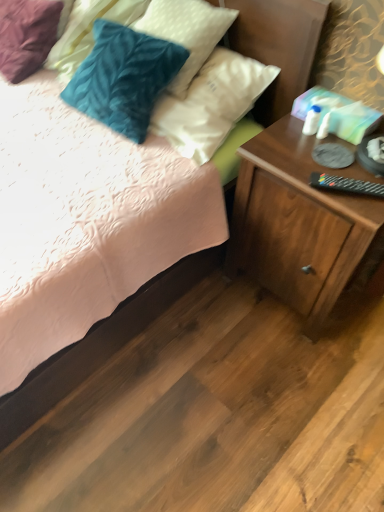
What do you see at coordinates (346, 185) in the screenshot? I see `black plastic remote control at right` at bounding box center [346, 185].

What do you see at coordinates (186, 32) in the screenshot? This screenshot has height=512, width=384. I see `velvety blue pillow at upper left, which is the first pillow in right-to-left order` at bounding box center [186, 32].

This screenshot has height=512, width=384. Find the location of `wooden nightstand at lower right`. wooden nightstand at lower right is located at coordinates (299, 223).

From the image's perspective, is wooden nightstand at lower right below velvety teal pillow at upper left, the first pillow in the left-to-right sequence?

Indeed, from the image's perspective, wooden nightstand at lower right is shown beneath velvety teal pillow at upper left, the first pillow in the left-to-right sequence.

Does wooden nightstand at lower right appear on the left side of velvety teal pillow at upper left, the first pillow in the left-to-right sequence?

No.

Between wooden nightstand at lower right and velvety teal pillow at upper left, the 2th pillow viewed from the right, which one has larger size?

With larger size is wooden nightstand at lower right.

Which of these two, wooden nightstand at lower right or velvety teal pillow at upper left, the first pillow in the left-to-right sequence, stands shorter?

velvety teal pillow at upper left, the first pillow in the left-to-right sequence, is shorter.

From the picture: From a real-world perspective, is velvety teal pillow at upper left, the 2th pillow viewed from the right, physically above velvety blue pillow at upper left, the 2th pillow from the left?

Actually, velvety teal pillow at upper left, the 2th pillow viewed from the right, is physically below velvety blue pillow at upper left, the 2th pillow from the left, in the real world.

In the scene shown: Considering the relative sizes of velvety teal pillow at upper left, the 2th pillow viewed from the right, and velvety blue pillow at upper left, which is the first pillow in right-to-left order, in the image provided, is velvety teal pillow at upper left, the 2th pillow viewed from the right, bigger than velvety blue pillow at upper left, which is the first pillow in right-to-left order,?

Yes.

Find the location of `pillow behind the velvety blue pillow at upper left, which is the first pillow in right-to-left order`. pillow behind the velvety blue pillow at upper left, which is the first pillow in right-to-left order is located at coordinates (88, 31).

Could you measure the distance between velvety teal pillow at upper left, the first pillow in the left-to-right sequence, and velvety blue pillow at upper left, which is the first pillow in right-to-left order?

A distance of 11.94 inches exists between velvety teal pillow at upper left, the first pillow in the left-to-right sequence, and velvety blue pillow at upper left, which is the first pillow in right-to-left order.

From a real-world perspective, between velvety teal pillow at upper left, the 2th pillow viewed from the right, and black plastic remote control at right, who is vertically higher?

black plastic remote control at right, from a real-world perspective.

Between point (80, 13) and point (311, 176), which one is positioned behind?

Positioned behind is point (80, 13).

Is velvety teal pillow at upper left, the first pillow in the left-to-right sequence, taller than black plastic remote control at right?

Correct, velvety teal pillow at upper left, the first pillow in the left-to-right sequence, is much taller as black plastic remote control at right.

From the image's perspective, which one is positioned lower, velvety teal pillow at upper left, the first pillow in the left-to-right sequence, or black plastic remote control at right?

black plastic remote control at right.

There is a black plastic remote control at right. In order to click on the 1st pillow above it (from the image's perspective) in this screenshot , I will do (x=186, y=32).

Considering the positions of objects velvety blue pillow at upper left, the 2th pillow from the left, and black plastic remote control at right in the image provided, who is in front, velvety blue pillow at upper left, the 2th pillow from the left, or black plastic remote control at right?

black plastic remote control at right is closer to the camera.

Considering the sizes of velvety blue pillow at upper left, the 2th pillow from the left, and black plastic remote control at right in the image, is velvety blue pillow at upper left, the 2th pillow from the left, bigger or smaller than black plastic remote control at right?

In the image, velvety blue pillow at upper left, the 2th pillow from the left, appears to be larger than black plastic remote control at right.

Which is less distant, (x=177, y=1) or (x=357, y=182)?

Point (x=177, y=1) is positioned farther from the camera compared to point (x=357, y=182).

Does black plastic remote control at right have a lesser height compared to velvety teal pillow at upper left, the 2th pillow viewed from the right?

Indeed, black plastic remote control at right has a lesser height compared to velvety teal pillow at upper left, the 2th pillow viewed from the right.

Who is smaller, black plastic remote control at right or velvety teal pillow at upper left, the 2th pillow viewed from the right?

With smaller size is black plastic remote control at right.

Is black plastic remote control at right in contact with velvety teal pillow at upper left, the 2th pillow viewed from the right?

No, black plastic remote control at right is not beside velvety teal pillow at upper left, the 2th pillow viewed from the right.

Is black plastic remote control at right looking in the opposite direction of velvety teal pillow at upper left, the first pillow in the left-to-right sequence?

No, black plastic remote control at right's orientation is not away from velvety teal pillow at upper left, the first pillow in the left-to-right sequence.

Can you confirm if velvety teal pillow at upper left, the 2th pillow viewed from the right, is smaller than wooden nightstand at lower right?

Correct, velvety teal pillow at upper left, the 2th pillow viewed from the right, occupies less space than wooden nightstand at lower right.

Could you tell me if velvety teal pillow at upper left, the 2th pillow viewed from the right, is facing wooden nightstand at lower right?

No, velvety teal pillow at upper left, the 2th pillow viewed from the right, is not oriented towards wooden nightstand at lower right.

Consider the image. Is velvety teal pillow at upper left, the 2th pillow viewed from the right, behind wooden nightstand at lower right?

Yes, it is.

From the image's perspective, which is above, velvety teal pillow at upper left, the 2th pillow viewed from the right, or wooden nightstand at lower right?

velvety teal pillow at upper left, the 2th pillow viewed from the right.

Is point (342, 183) positioned in front of point (176, 7)?

That is True.

Is black plastic remote control at right smaller than velvety blue pillow at upper left, the 2th pillow from the left?

Indeed, black plastic remote control at right has a smaller size compared to velvety blue pillow at upper left, the 2th pillow from the left.

Which is more to the right, black plastic remote control at right or velvety blue pillow at upper left, the 2th pillow from the left?

From the viewer's perspective, black plastic remote control at right appears more on the right side.

Based on the photo, is black plastic remote control at right turned away from velvety blue pillow at upper left, which is the first pillow in right-to-left order?

black plastic remote control at right is not turned away from velvety blue pillow at upper left, which is the first pillow in right-to-left order.

At what (x,y) coordinates should I click in order to perform the action: click on the 2nd pillow above when counting from the wooden nightstand at lower right (from the image's perspective). Please return your answer as a coordinate pair (x, y). The height and width of the screenshot is (512, 384). Looking at the image, I should click on (88, 31).

Identify the location of pillow below the velvety blue pillow at upper left, which is the first pillow in right-to-left order (from a real-world perspective). (88, 31).

When comparing their distances from velvety teal pillow at upper left, the first pillow in the left-to-right sequence, does velvety blue pillow at upper left, which is the first pillow in right-to-left order, or black plastic remote control at right seem closer?

Based on the image, velvety blue pillow at upper left, which is the first pillow in right-to-left order, appears to be nearer to velvety teal pillow at upper left, the first pillow in the left-to-right sequence.

From the image, which object appears to be farther from black plastic remote control at right, velvety blue pillow at upper left, which is the first pillow in right-to-left order, or wooden nightstand at lower right?

Among the two, velvety blue pillow at upper left, which is the first pillow in right-to-left order, is located further to black plastic remote control at right.

Which object lies further to the anchor point black plastic remote control at right, wooden nightstand at lower right or velvety blue pillow at upper left, which is the first pillow in right-to-left order?

velvety blue pillow at upper left, which is the first pillow in right-to-left order, is positioned further to the anchor black plastic remote control at right.

Based on their spatial positions, is black plastic remote control at right or velvety teal pillow at upper left, the 2th pillow viewed from the right, further from wooden nightstand at lower right?

The object further to wooden nightstand at lower right is velvety teal pillow at upper left, the 2th pillow viewed from the right.

Estimate the real-world distances between objects in this image. Which object is further from black plastic remote control at right, velvety teal pillow at upper left, the 2th pillow viewed from the right, or velvety blue pillow at upper left, which is the first pillow in right-to-left order?

velvety teal pillow at upper left, the 2th pillow viewed from the right, lies further to black plastic remote control at right than the other object.

Looking at the image, which one is located closer to wooden nightstand at lower right, black plastic remote control at right or velvety blue pillow at upper left, the 2th pillow from the left?

Among the two, black plastic remote control at right is located nearer to wooden nightstand at lower right.

Considering their positions, is black plastic remote control at right positioned further to velvety teal pillow at upper left, the 2th pillow viewed from the right, than velvety blue pillow at upper left, which is the first pillow in right-to-left order?

Based on the image, black plastic remote control at right appears to be further to velvety teal pillow at upper left, the 2th pillow viewed from the right.

Which object lies further to the anchor point wooden nightstand at lower right, velvety blue pillow at upper left, which is the first pillow in right-to-left order, or velvety teal pillow at upper left, the 2th pillow viewed from the right?

velvety teal pillow at upper left, the 2th pillow viewed from the right, lies further to wooden nightstand at lower right than the other object.

Locate an element on the screen. pillow between velvety teal pillow at upper left, the 2th pillow viewed from the right, and black plastic remote control at right is located at coordinates (186, 32).

The width and height of the screenshot is (384, 512). I want to click on pillow that lies between velvety teal pillow at upper left, the first pillow in the left-to-right sequence, and wooden nightstand at lower right from top to bottom, so click(x=186, y=32).

Where is `nightstand between velvety teal pillow at upper left, the first pillow in the left-to-right sequence, and black plastic remote control at right`? nightstand between velvety teal pillow at upper left, the first pillow in the left-to-right sequence, and black plastic remote control at right is located at coordinates (299, 223).

The image size is (384, 512). In order to click on remote control between velvety blue pillow at upper left, the 2th pillow from the left, and wooden nightstand at lower right in the up-down direction in this screenshot , I will do `click(346, 185)`.